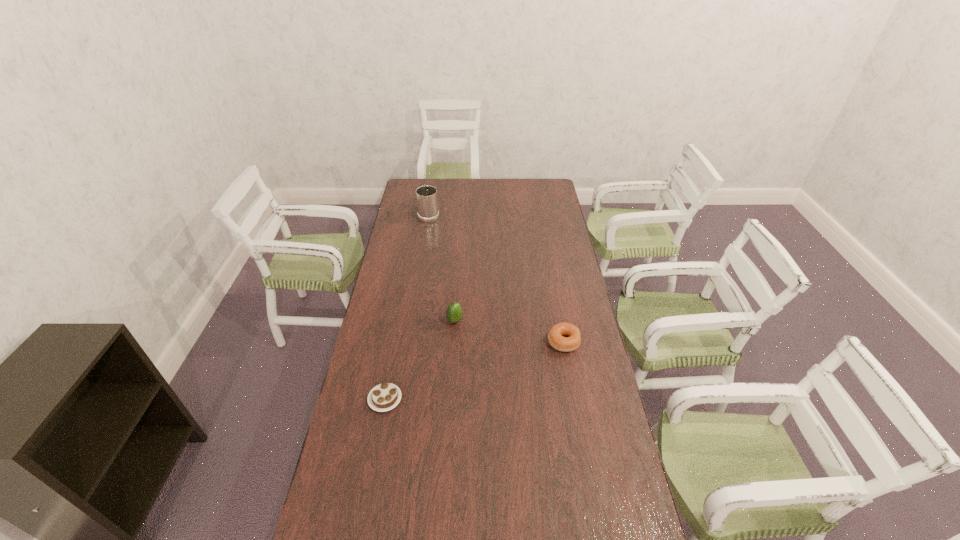
Locate an element on the screen. The width and height of the screenshot is (960, 540). vacant region located on the side of the farthest object with the handle is located at coordinates (434, 185).

The image size is (960, 540). Identify the location of vacant space located 0.330m on the front of the avocado. (450, 399).

This screenshot has width=960, height=540. I want to click on vacant space located 0.380m on the front of the bagel, so click(x=584, y=451).

At what (x,y) coordinates should I click in order to perform the action: click on vacant space located 0.160m on the right of the shortest object. Please return your answer as a coordinate pair (x, y). The width and height of the screenshot is (960, 540). Looking at the image, I should click on (448, 399).

Where is `mug present at the left edge`? The image size is (960, 540). mug present at the left edge is located at coordinates (427, 202).

The height and width of the screenshot is (540, 960). In order to click on chocolate cake that is at the left edge in this screenshot , I will do `click(386, 396)`.

Locate an element on the screen. This screenshot has height=540, width=960. object that is at the right edge is located at coordinates (566, 337).

You are a GUI agent. You are given a task and a screenshot of the screen. Output one action in this format:
    pyautogui.click(x=<x>, y=<y>)
    Task: Click on the vacant point at the far edge
    
    Given the screenshot: What is the action you would take?
    pyautogui.click(x=477, y=194)

Image resolution: width=960 pixels, height=540 pixels. In the image, there is a desktop. In order to click on vacant space at the left edge in this screenshot , I will do `click(340, 438)`.

Locate an element on the screen. The image size is (960, 540). free region at the right edge of the desktop is located at coordinates (633, 530).